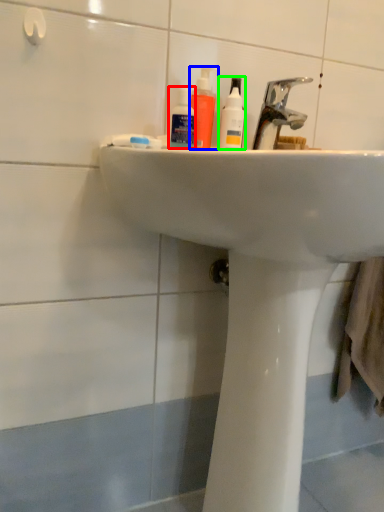
Question: Which object is the closest to the mouthwash (highlighted by a red box)? Choose among these: mouthwash (highlighted by a blue box) or cleaning product (highlighted by a green box).

Choices:
 (A) mouthwash
 (B) cleaning product

Answer: (A)